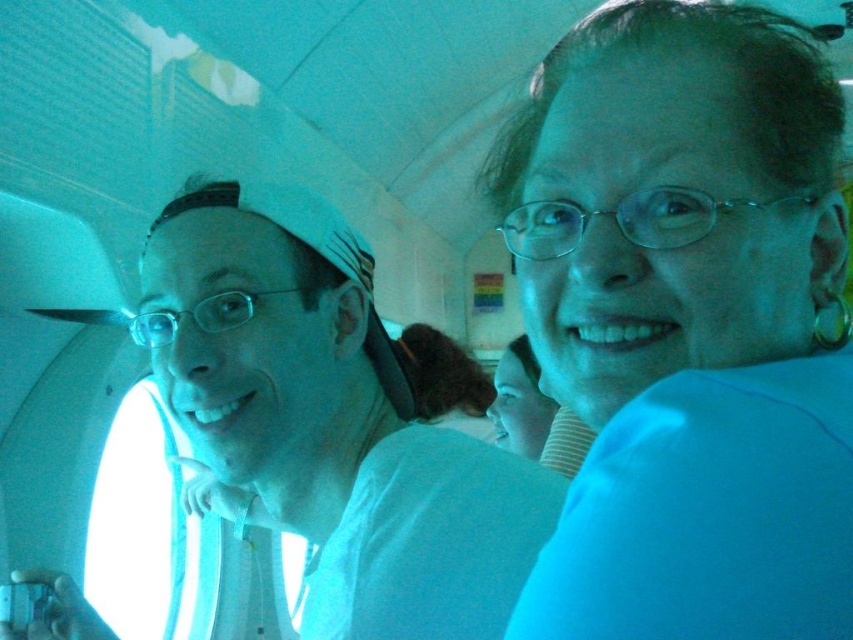
Question: Which object appears closest to the camera in this image?

Choices:
 (A) white fabric at left
 (B) blue fabric shirt at upper right
 (C) smooth skin face at center

Answer: (B)

Question: From the image, what is the correct spatial relationship of blue fabric shirt at upper right in relation to white fabric at left?

Choices:
 (A) right
 (B) left

Answer: (A)

Question: Is blue fabric shirt at upper right thinner than white fabric at left?

Choices:
 (A) yes
 (B) no

Answer: (A)

Question: Which object is the farthest from the white fabric at left?

Choices:
 (A) blue fabric shirt at upper right
 (B) smooth skin face at center

Answer: (B)

Question: Does blue fabric shirt at upper right have a larger size compared to smooth skin face at center?

Choices:
 (A) yes
 (B) no

Answer: (A)

Question: Among these objects, which one is farthest from the camera?

Choices:
 (A) blue fabric shirt at upper right
 (B) smooth skin face at center
 (C) white fabric at left

Answer: (B)